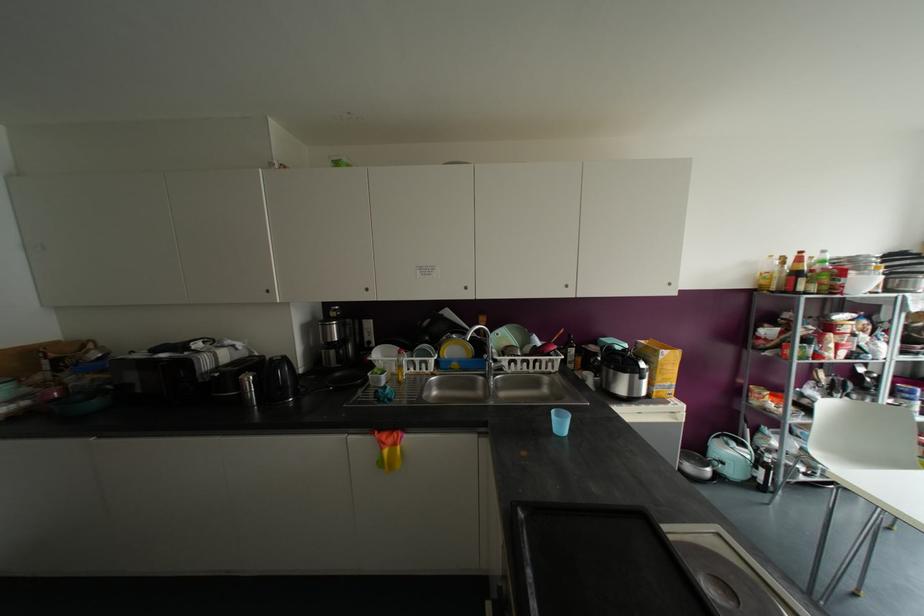
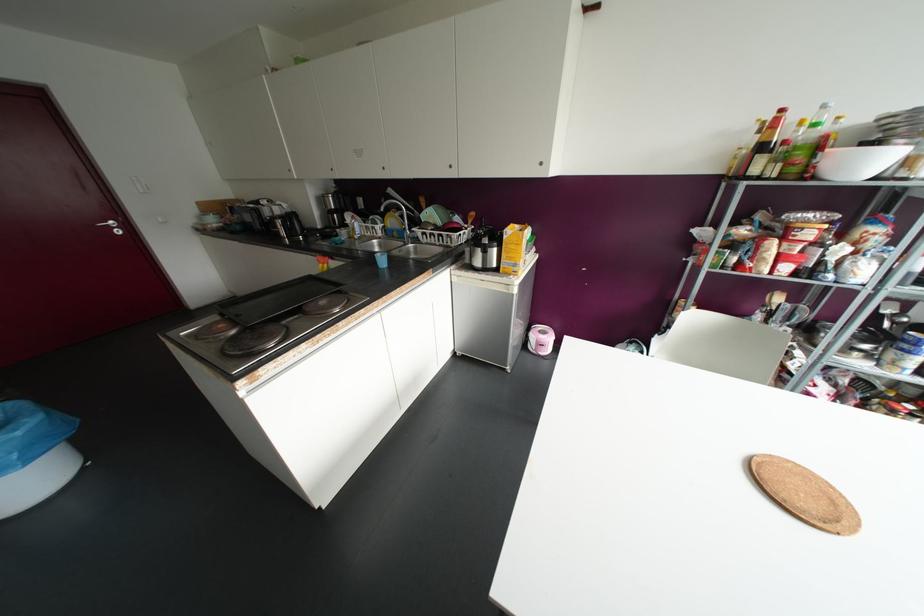
The point at [800,252] is marked in the first image. Where is the corresponding point in the second image?

(781, 110)